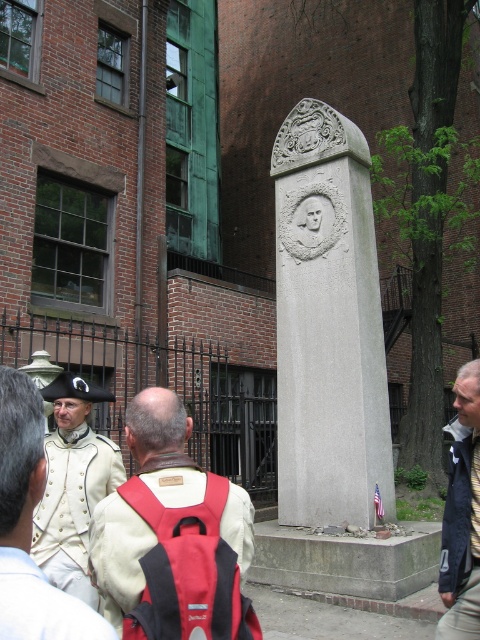
Question: Does smooth skin face at center lie in front of matte white face at center?

Choices:
 (A) yes
 (B) no

Answer: (A)

Question: Can you confirm if gray stone monument at center is bigger than red backpack at center?

Choices:
 (A) yes
 (B) no

Answer: (A)

Question: Does gray stone monument at center have a lesser width compared to blue striped tie at center?

Choices:
 (A) yes
 (B) no

Answer: (B)

Question: Which object appears farthest from the camera in this image?

Choices:
 (A) white matte uniform at center
 (B) matte white face at center
 (C) red backpack at center

Answer: (B)

Question: Among these points, which one is nearest to the camera?

Choices:
 (A) (470, 406)
 (B) (73, 620)
 (C) (120, 570)
 (D) (47, 499)

Answer: (B)

Question: Which of the following is the closest to the observer?

Choices:
 (A) (84, 620)
 (B) (479, 428)
 (C) (156, 636)
 (D) (93, 464)

Answer: (A)